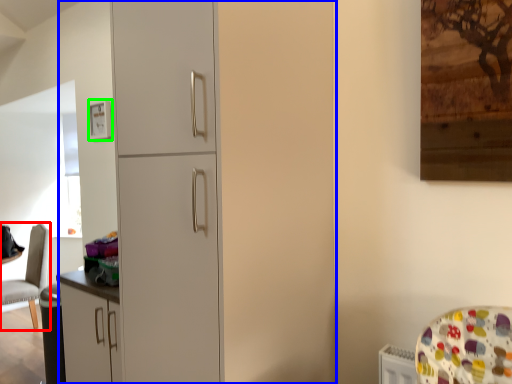
Question: Estimate the real-world distances between objects in this image. Which object is closer to chair (highlighted by a red box), dresser (highlighted by a blue box) or picture frame (highlighted by a green box)?

Choices:
 (A) dresser
 (B) picture frame

Answer: (B)